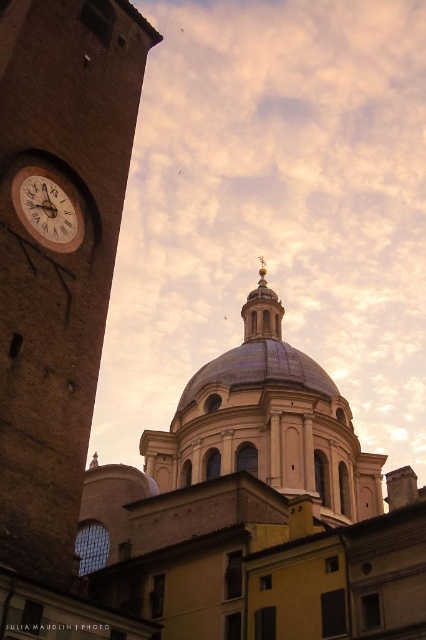
Question: Is smooth white dome at center closer to the viewer compared to gold polished dome at center?

Choices:
 (A) no
 (B) yes

Answer: (B)

Question: Can you confirm if wooden clock face at upper left is wider than gold polished dome at center?

Choices:
 (A) no
 (B) yes

Answer: (A)

Question: Among these points, which one is nearest to the camera?

Choices:
 (A) (123, 182)
 (B) (250, 296)

Answer: (A)

Question: Can you confirm if brick tower at left is positioned above gold polished dome at center?

Choices:
 (A) yes
 (B) no

Answer: (B)

Question: Which point appears farthest from the camera in this image?

Choices:
 (A) (339, 596)
 (B) (68, 195)
 (C) (264, 317)

Answer: (C)

Question: Which of the following is the closest to the observer?

Choices:
 (A) gold polished dome at center
 (B) wooden clock face at upper left
 (C) smooth white dome at center
 (D) brick tower at left

Answer: (D)